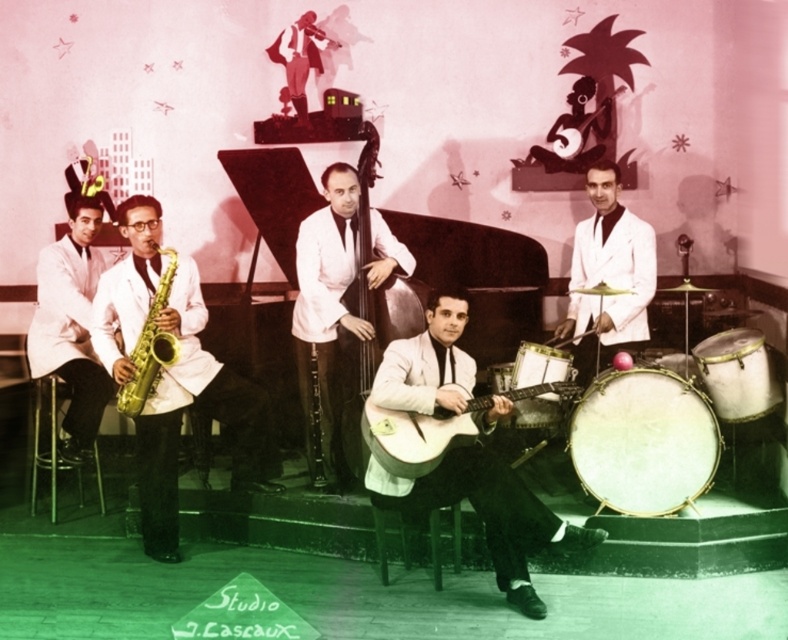
Question: Does light brown wooden guitar at center lie in front of white leather drum at lower right?

Choices:
 (A) no
 (B) yes

Answer: (B)

Question: Does light wood acoustic guitar at center appear under white matte suit at right?

Choices:
 (A) yes
 (B) no

Answer: (A)

Question: Which point appears closest to the camera in this image?

Choices:
 (A) (519, 401)
 (B) (469, 422)

Answer: (B)

Question: From the image, what is the correct spatial relationship of gold lacquered saxophone at left in relation to white drum at lower right?

Choices:
 (A) below
 (B) above

Answer: (B)

Question: Which of these objects is positioned farthest from the gold shiny saxophone at left?

Choices:
 (A) white matte bass at center
 (B) white leather drum at lower right

Answer: (B)

Question: Among these points, which one is farthest from the camera?

Choices:
 (A) (132, 248)
 (B) (580, 458)
 (C) (456, 305)
 (D) (671, 368)

Answer: (D)